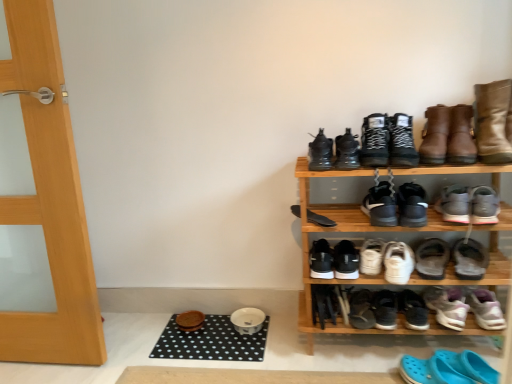
Where is `vacant space underneath black dotted mat at lower center, the first doormat in the back-to-front sequence (from a real-world perspective)`? This screenshot has height=384, width=512. vacant space underneath black dotted mat at lower center, the first doormat in the back-to-front sequence (from a real-world perspective) is located at coordinates (210, 335).